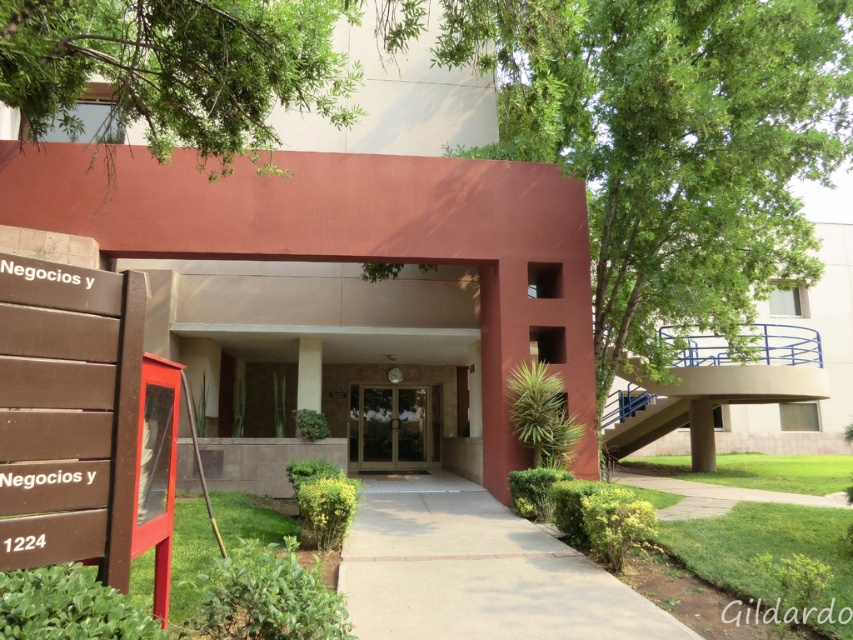
Which of these two, concrete at center or brown glass doors at center, stands shorter?

With less height is concrete at center.

Which is below, concrete at center or brown glass doors at center?

brown glass doors at center is lower down.

Where is `concrete at center`? This screenshot has height=640, width=853. concrete at center is located at coordinates (477, 572).

Identify the location of concrete at center. This screenshot has height=640, width=853. [477, 572].

Is green leafy tree at center shorter than concrete at center?

No.

Identify the location of green leafy tree at center. (671, 141).

Is point (531, 88) positioned in front of point (437, 528)?

Yes.

Where is `green leafy tree at center`? The image size is (853, 640). green leafy tree at center is located at coordinates (671, 141).

Does brown wood sign at left have a smaller size compared to concrete at center?

Actually, brown wood sign at left might be larger than concrete at center.

Which is in front, point (97, 525) or point (433, 580)?

Positioned in front is point (97, 525).

Find the location of `brown wood sign at left`. brown wood sign at left is located at coordinates (68, 413).